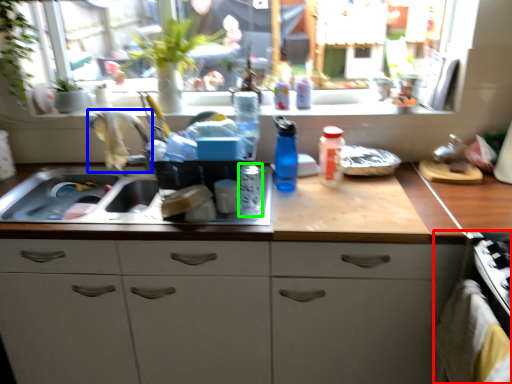
Question: Which object is positioned farthest from oven (highlighted by a red box)? Select from faucet (highlighted by a blue box) and bottle (highlighted by a green box).

Choices:
 (A) faucet
 (B) bottle

Answer: (A)